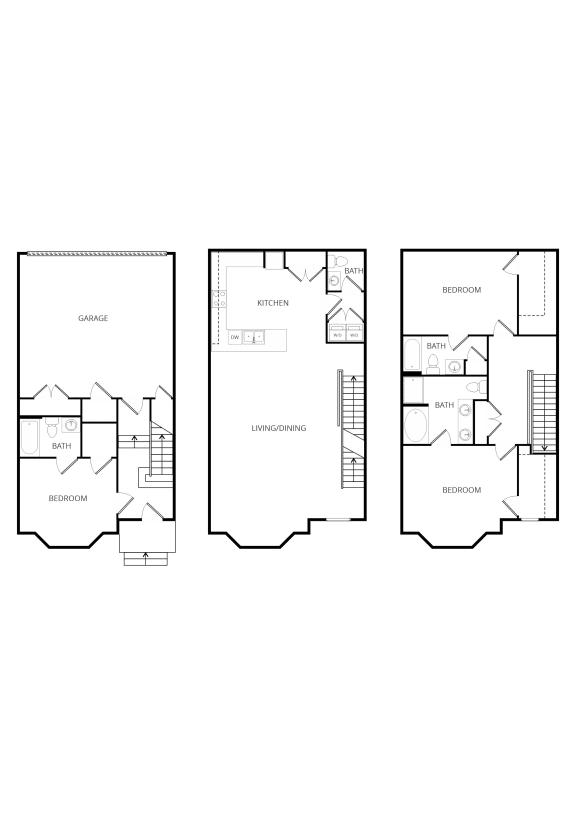
Identify the location of stairs inside and ourside. (135, 443), (161, 448), (159, 562), (348, 400), (346, 475), (541, 423).